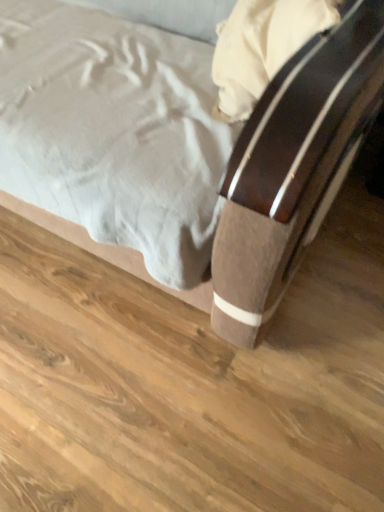
Locate an element on the screen. The width and height of the screenshot is (384, 512). free spot above brown wood bed frame at lower center (from a real-world perspective) is located at coordinates (186, 343).